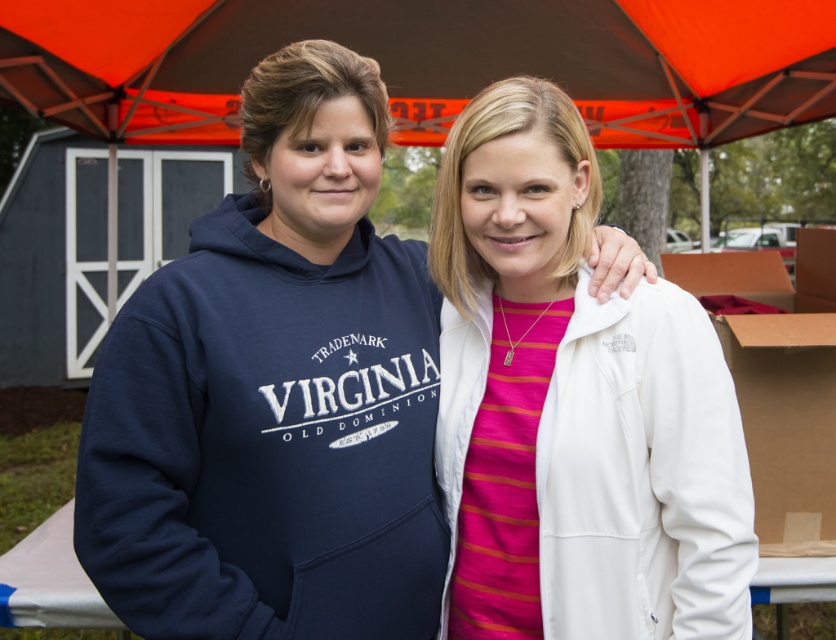
Can you confirm if navy fleece sweatshirt at center is positioned to the left of white fleece sweatshirt at center?

Correct, you'll find navy fleece sweatshirt at center to the left of white fleece sweatshirt at center.

Which of these two, navy fleece sweatshirt at center or white fleece sweatshirt at center, stands taller?

navy fleece sweatshirt at center is taller.

This screenshot has width=836, height=640. Identify the location of navy fleece sweatshirt at center. (268, 442).

Does navy blue hoodie at left appear over white fleece sweatshirt at center?

Yes.

Can you confirm if navy blue hoodie at left is shorter than white fleece sweatshirt at center?

No, navy blue hoodie at left is not shorter than white fleece sweatshirt at center.

Is point (87, 490) positioned before point (483, 368)?

Yes.

Find the location of a particular element. navy blue hoodie at left is located at coordinates (274, 396).

Measure the distance between navy blue hoodie at left and camera.

The distance of navy blue hoodie at left from camera is 4.56 feet.

Describe the element at coordinates (274, 396) in the screenshot. I see `navy blue hoodie at left` at that location.

Identify the location of navy blue hoodie at left. (274, 396).